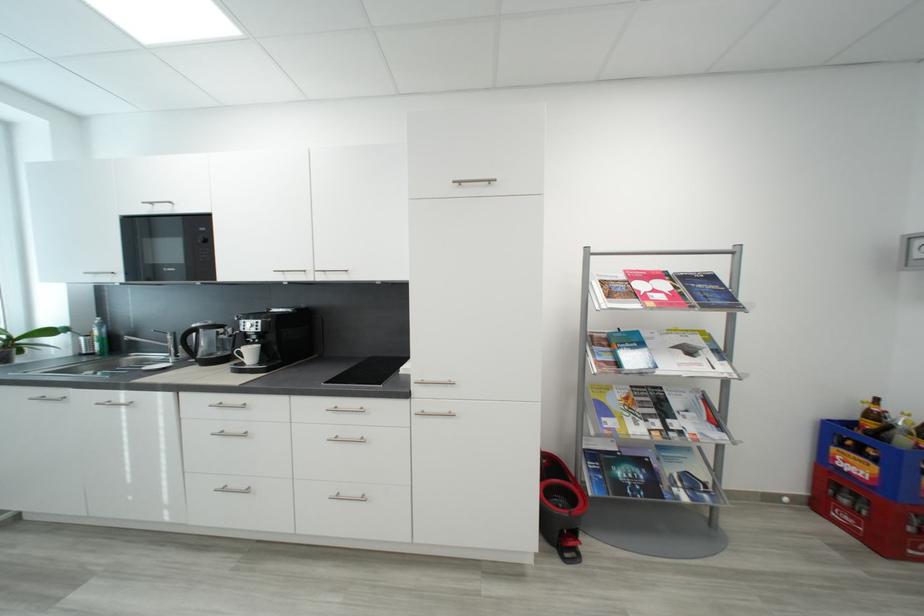
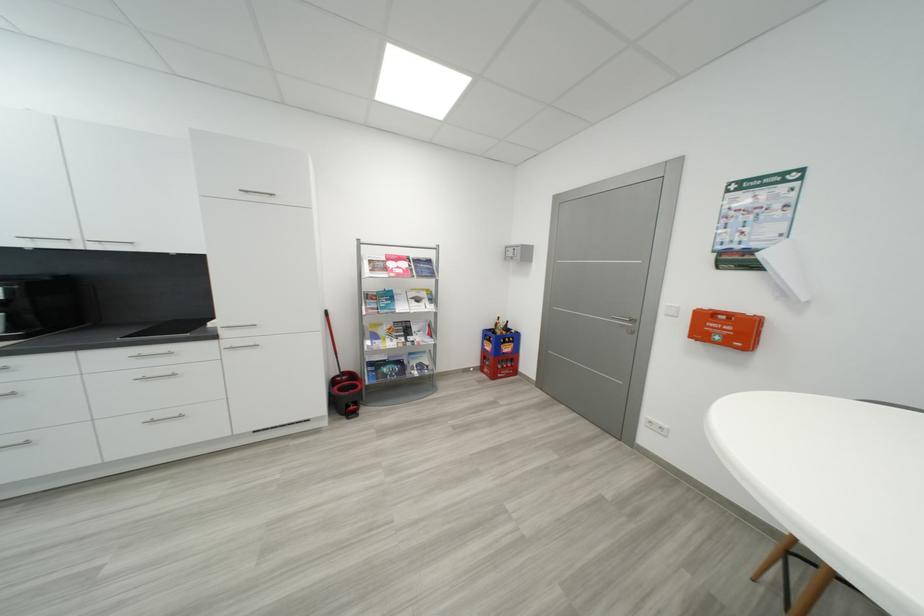
In the second image, find the point that corresponds to the point at 426,413 in the first image.

(235, 349)